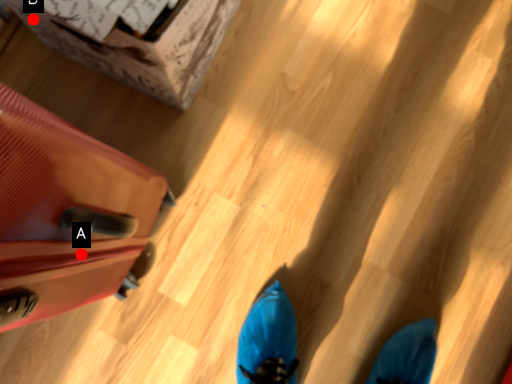
Question: Two points are circled on the image, labeled by A and B beside each circle. Which of the following is the closest to the observer?

Choices:
 (A) A is closer
 (B) B is closer

Answer: (A)